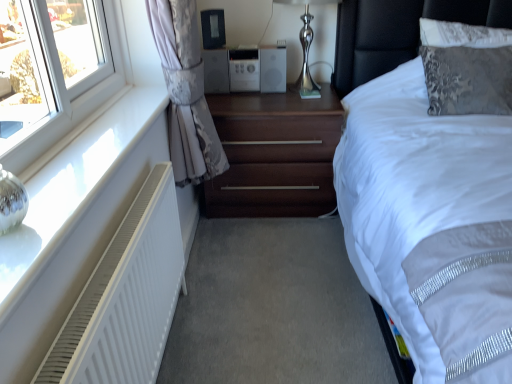
Where is `vacant region above white matte radiator at lower left (from a real-world perspective)`? vacant region above white matte radiator at lower left (from a real-world perspective) is located at coordinates (84, 149).